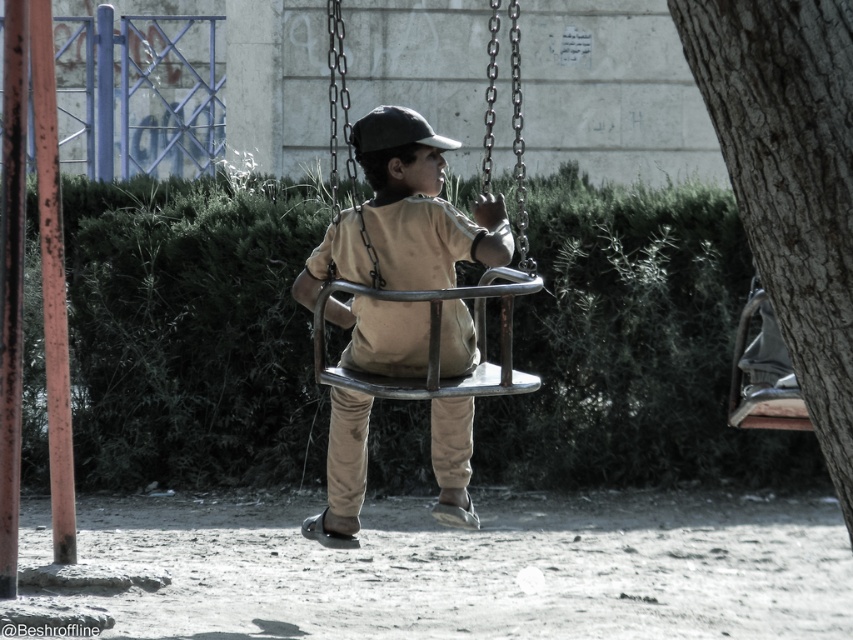
Question: Which point is closer to the camera?

Choices:
 (A) (846, 83)
 (B) (416, 122)

Answer: (A)

Question: Does matte brown swing at center appear on the right side of metallic swing at center?

Choices:
 (A) yes
 (B) no

Answer: (B)

Question: Can you confirm if smooth bark tree at right is smaller than matte brown swing at center?

Choices:
 (A) yes
 (B) no

Answer: (A)

Question: Which is farther from the black matte baseball hat at center?

Choices:
 (A) smooth bark tree at right
 (B) metallic swing at center

Answer: (B)

Question: Which object appears farthest from the camera in this image?

Choices:
 (A) smooth bark tree at right
 (B) matte brown swing at center

Answer: (B)

Question: Can you confirm if smooth bark tree at right is positioned below black matte baseball hat at center?

Choices:
 (A) no
 (B) yes

Answer: (B)